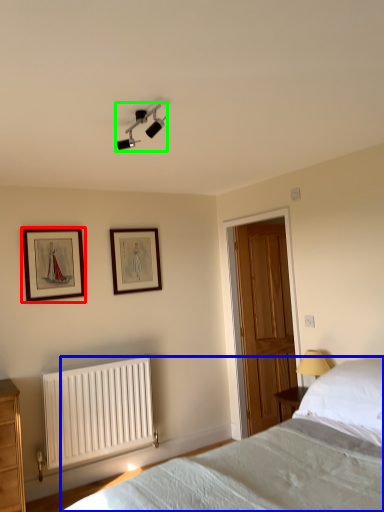
Question: Which object is the closest to the picture frame (highlighted by a red box)? Choose among these: bed (highlighted by a blue box) or light fixture (highlighted by a green box).

Choices:
 (A) bed
 (B) light fixture

Answer: (B)